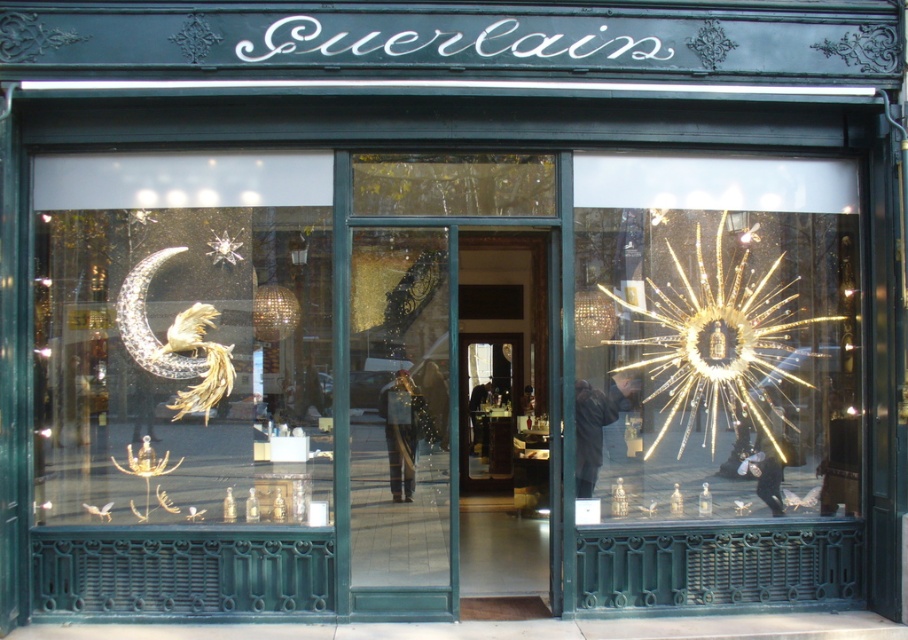
You are a customer approaching the Guerlain boutique entrance. You see the shiny gold starburst at center and the transparent glass door at center. Which object is positioned higher relative to the other?

The shiny gold starburst at center is located above the transparent glass door at center, so it is positioned higher.

You are standing in front of the Guerlain boutique and want to locate the shiny gold starburst at center. According to the coordinates provided, where would you look relative to the store entrance?

The shiny gold starburst at center is located at coordinates point (716, 378), which would be slightly to the right and lower middle area of the store entrance.